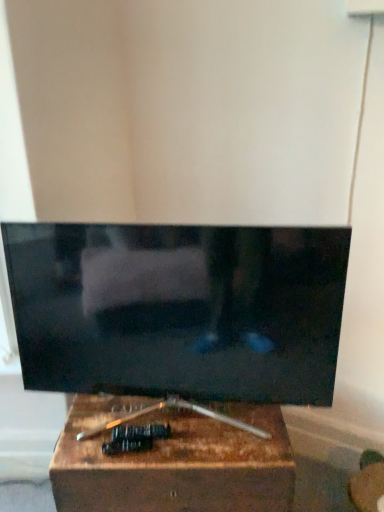
Where is `free space above wooden box at center (from a real-world perspective)`? Image resolution: width=384 pixels, height=512 pixels. free space above wooden box at center (from a real-world perspective) is located at coordinates (173, 429).